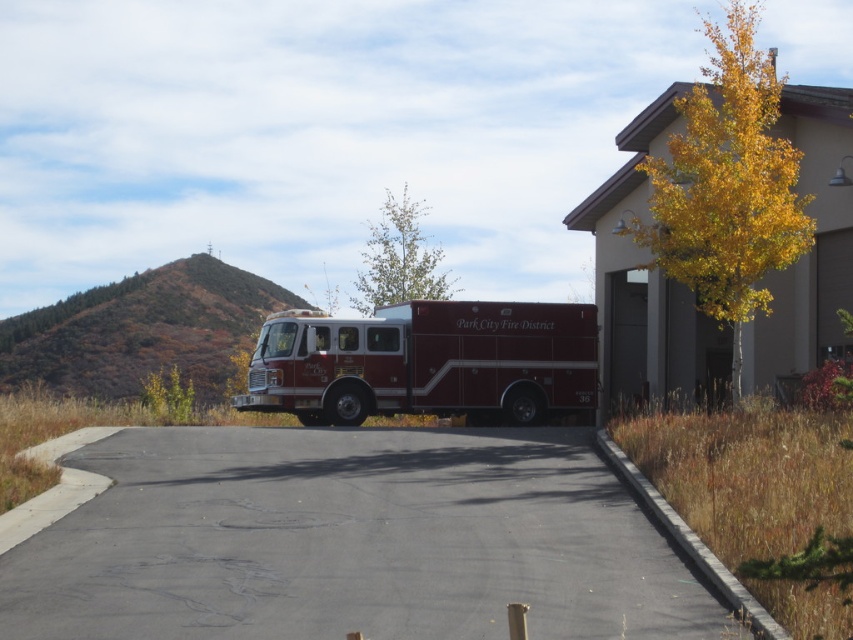
Can you confirm if black asphalt driveway at center is shorter than shiny red fire truck at center?

Indeed, black asphalt driveway at center has a lesser height compared to shiny red fire truck at center.

Describe the element at coordinates (352, 541) in the screenshot. The width and height of the screenshot is (853, 640). I see `black asphalt driveway at center` at that location.

You are a GUI agent. You are given a task and a screenshot of the screen. Output one action in this format:
    pyautogui.click(x=<x>, y=<y>)
    Task: Click on the black asphalt driveway at center
    
    Given the screenshot: What is the action you would take?
    pyautogui.click(x=352, y=541)

Is point (840, 156) farther from viewer compared to point (524, 321)?

No, it is in front of (524, 321).

Where is `beige concrete fire station at right`? This screenshot has height=640, width=853. beige concrete fire station at right is located at coordinates (645, 284).

Does black asphalt driveway at center appear on the right side of beige concrete fire station at right?

In fact, black asphalt driveway at center is to the left of beige concrete fire station at right.

Is black asphalt driveway at center bigger than beige concrete fire station at right?

Actually, black asphalt driveway at center might be smaller than beige concrete fire station at right.

Locate an element on the screen. Image resolution: width=853 pixels, height=640 pixels. black asphalt driveway at center is located at coordinates (352, 541).